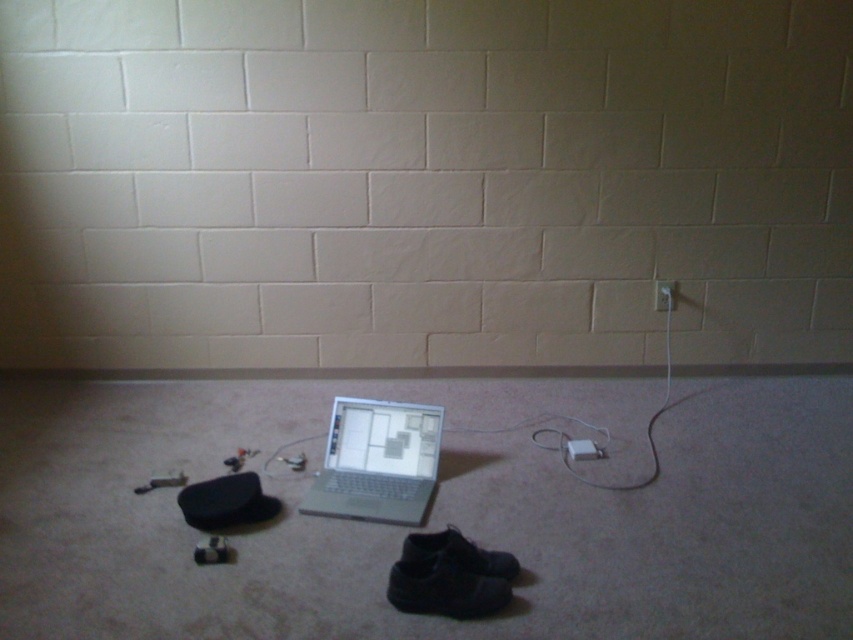
Question: Can you confirm if silver metallic laptop at center is positioned to the right of white plastic electric outlet at upper right?

Choices:
 (A) no
 (B) yes

Answer: (A)

Question: Among these objects, which one is nearest to the camera?

Choices:
 (A) white plastic electric outlet at upper right
 (B) silver metallic laptop at center
 (C) white plastic plug at lower center

Answer: (B)

Question: Estimate the real-world distances between objects in this image. Which object is closer to the silver metallic laptop at center?

Choices:
 (A) white plastic plug at lower center
 (B) white plastic electric outlet at upper right

Answer: (A)

Question: Does white plastic plug at lower center have a smaller size compared to white plastic electric outlet at upper right?

Choices:
 (A) yes
 (B) no

Answer: (B)

Question: Which is farther from the silver metallic laptop at center?

Choices:
 (A) white plastic plug at lower center
 (B) white plastic electric outlet at upper right

Answer: (B)

Question: Can you confirm if silver metallic laptop at center is bigger than white plastic plug at lower center?

Choices:
 (A) no
 (B) yes

Answer: (B)